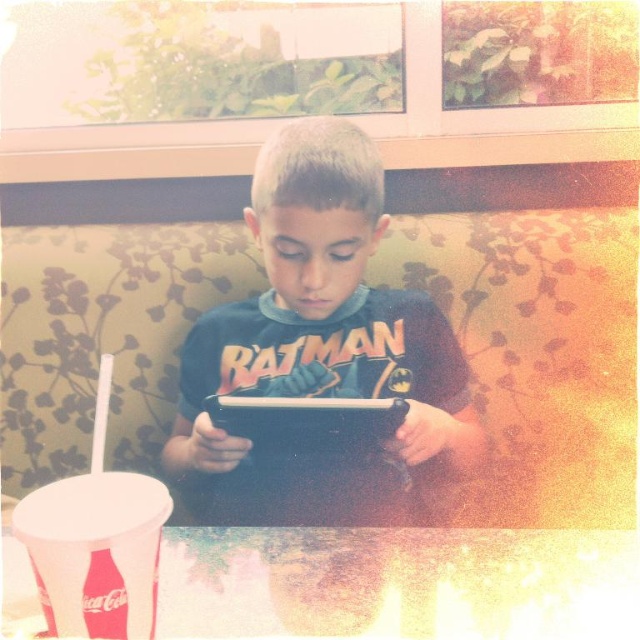
You are standing in a diner and see a point marked at coordinates (365, 291). If you want to place a 1.2 meter long tablecloth on the table where the boy is sitting, will the tablecloth reach the point?

The point at coordinates (365, 291) is 1.13 meters away from the viewer. Since the tablecloth is 1.2 meters long, it will just barely reach the point.